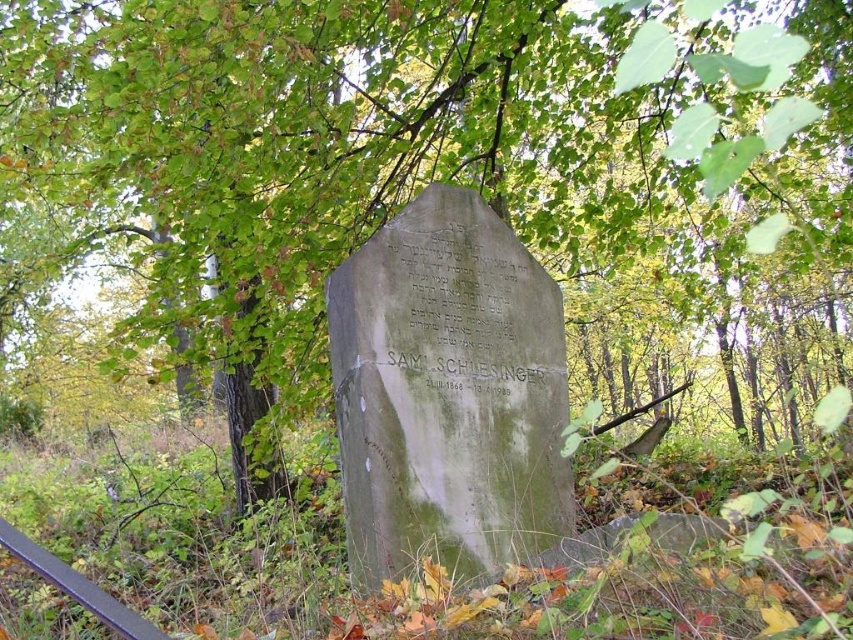
Question: Which object appears closest to the camera in this image?

Choices:
 (A) green mossy stone at center
 (B) metallic rail at lower left

Answer: (B)

Question: Which point is farther to the camera?

Choices:
 (A) metallic rail at lower left
 (B) green mossy stone at center

Answer: (B)

Question: Can you confirm if green mossy stone at center is positioned above metallic rail at lower left?

Choices:
 (A) no
 (B) yes

Answer: (B)

Question: Is green mossy stone at center above metallic rail at lower left?

Choices:
 (A) yes
 (B) no

Answer: (A)

Question: Can you confirm if green mossy stone at center is positioned below metallic rail at lower left?

Choices:
 (A) yes
 (B) no

Answer: (B)

Question: Which of the following is the farthest from the observer?

Choices:
 (A) metallic rail at lower left
 (B) green mossy stone at center

Answer: (B)